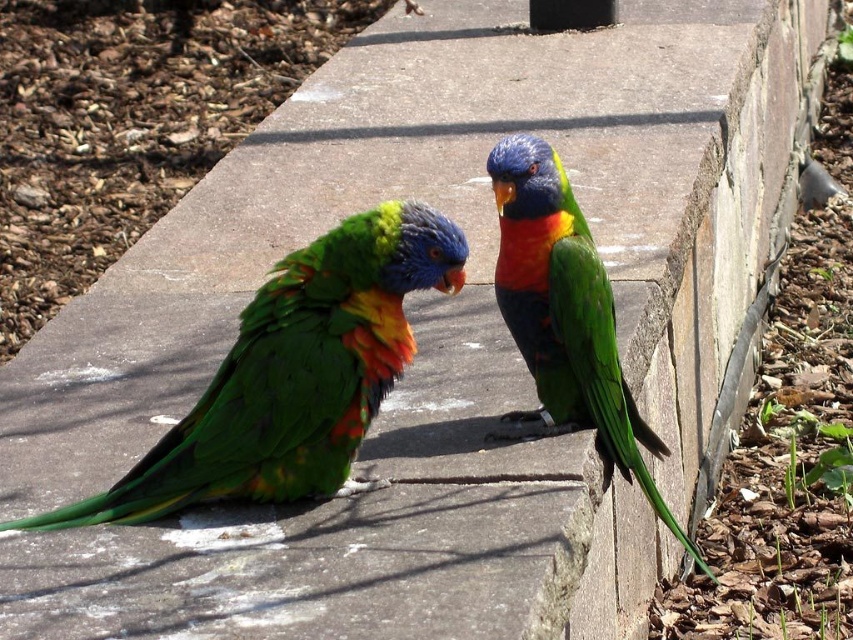
Is multicolored feathered parrot at center below shiny multicolored parrot at center?

Yes, multicolored feathered parrot at center is below shiny multicolored parrot at center.

Is multicolored feathered parrot at center behind shiny multicolored parrot at center?

Answer: No.

Is point (323, 307) farther from camera compared to point (601, 339)?

No, (323, 307) is closer to viewer.

This screenshot has height=640, width=853. Identify the location of multicolored feathered parrot at center. (293, 374).